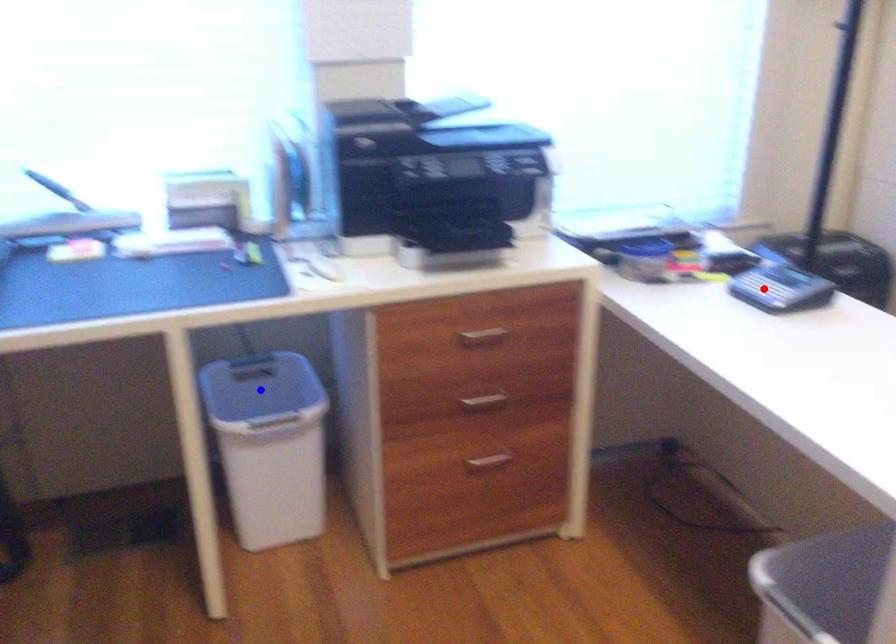
Question: Which of the two points in the image is closer to the camera?

Choices:
 (A) Blue point is closer.
 (B) Red point is closer.

Answer: (B)